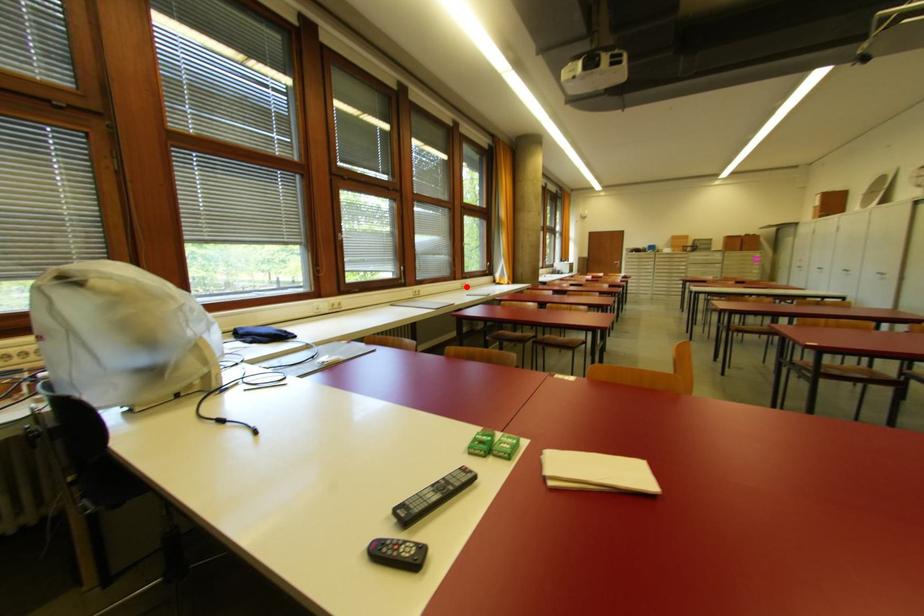
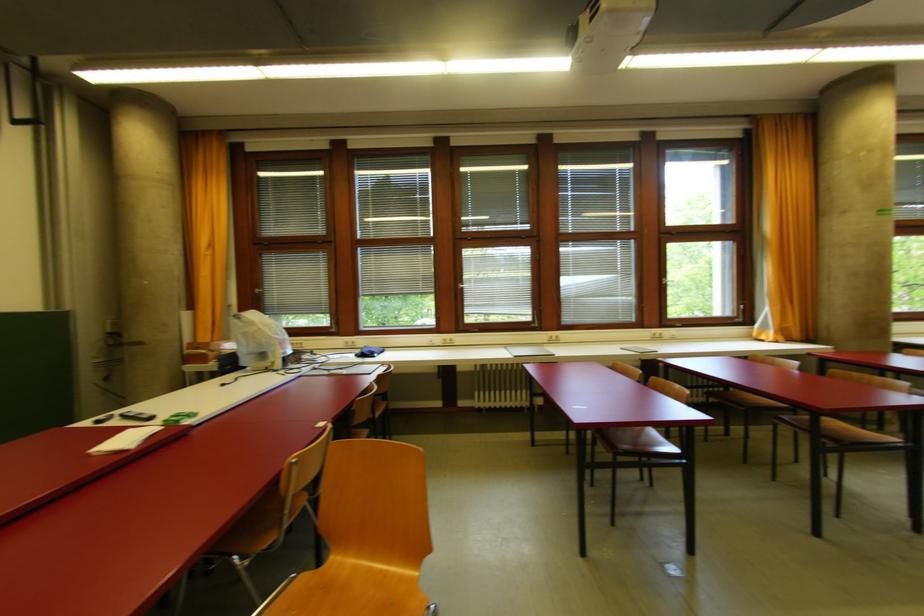
Question: I am providing you with two images of the same scene from different viewpoints. In image1, a red point is highlighted. Considering the same 3D point in image2, which of the following is correct?

Choices:
 (A) It is closer
 (B) It is farther

Answer: (B)